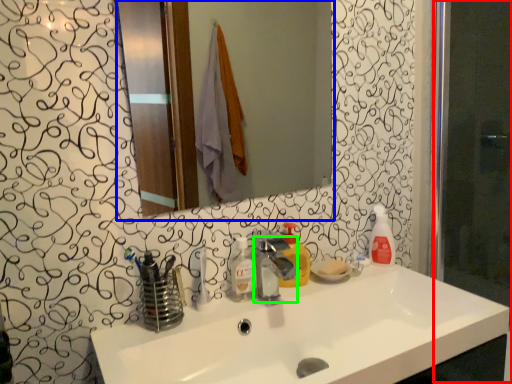
Question: Which is farther away from screen door (highlighted by a red box)? mirror (highlighted by a blue box) or tap (highlighted by a green box)?

Choices:
 (A) mirror
 (B) tap

Answer: (A)